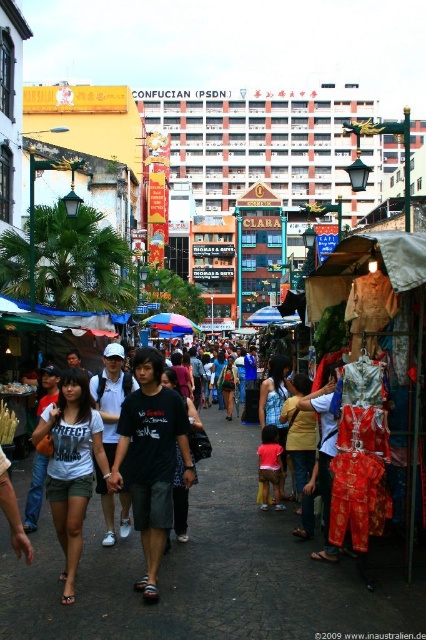
Question: Can you confirm if black cotton shirt at center is positioned below white cotton t-shirt at center?

Choices:
 (A) yes
 (B) no

Answer: (B)

Question: Is white cotton t-shirt at center wider than dark clothing crowd at center?

Choices:
 (A) yes
 (B) no

Answer: (B)

Question: Among these objects, which one is farthest from the camera?

Choices:
 (A) dark clothing crowd at center
 (B) black cotton shirt at center

Answer: (A)

Question: Considering the real-world distances, which object is farthest from the white cotton t-shirt at center?

Choices:
 (A) dark clothing crowd at center
 (B) black cotton shirt at center

Answer: (A)

Question: Can you confirm if black cotton shirt at center is positioned above white cotton t-shirt at center?

Choices:
 (A) yes
 (B) no

Answer: (A)

Question: Estimate the real-world distances between objects in this image. Which object is closer to the white cotton t-shirt at center?

Choices:
 (A) dark clothing crowd at center
 (B) black cotton shirt at center

Answer: (B)